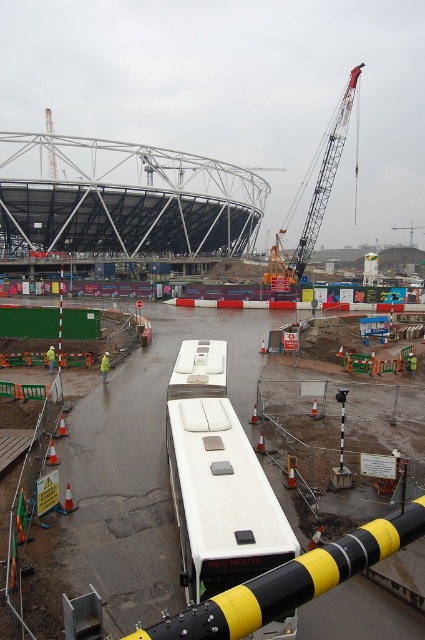
You are a delivery driver who needs to park your 3.5 meter wide truck in this construction site. There is a white rubber bus at center and a metallic gray crane at upper right. Which object has a smaller width, and can you safely park your truck between them without hitting either?

The white rubber bus at center has a smaller width than the metallic gray crane at upper right. Since your truck is 3.5 meters wide and the bus is narrower, you should park closer to the bus to ensure enough space. However, the exact distance between them isn

You are a delivery driver who needs to park your truck near the construction site. You see the white rubber bus at center and the metallic gray crane at upper right. Is there enough space to park your truck between them?

The white rubber bus at center is positioned under metallic gray crane at upper right, so there is no space between them for parking your truck.